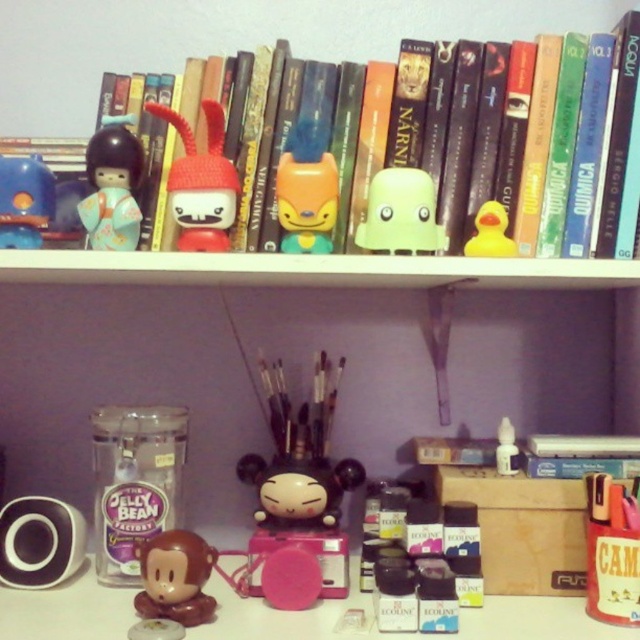
Question: Which is farther from the hardcover book at upper center?

Choices:
 (A) translucent plastic jelly bean container at lower left
 (B) yellow rubber duck at upper center
 (C) green matte toy at center
 (D) knitted fabric toy at center

Answer: (A)

Question: Observing the image, what is the correct spatial positioning of matte brown figurine at lower left in reference to green matte toy at center?

Choices:
 (A) below
 (B) above

Answer: (A)

Question: Is yellow rubber duck at upper center positioned at the back of white plastic figurine at center?

Choices:
 (A) no
 (B) yes

Answer: (A)

Question: Where is knitted fabric toy at center located in relation to matte blue rubber duck at upper left in the image?

Choices:
 (A) below
 (B) above

Answer: (B)

Question: Which object appears closest to the camera in this image?

Choices:
 (A) translucent plastic jelly bean container at lower left
 (B) matte porcelain figurine at upper left
 (C) matte brown figurine at lower left

Answer: (C)

Question: Which point appears farthest from the camera in this image?

Choices:
 (A) (636, 195)
 (B) (40, 212)
 (C) (316, 168)

Answer: (B)